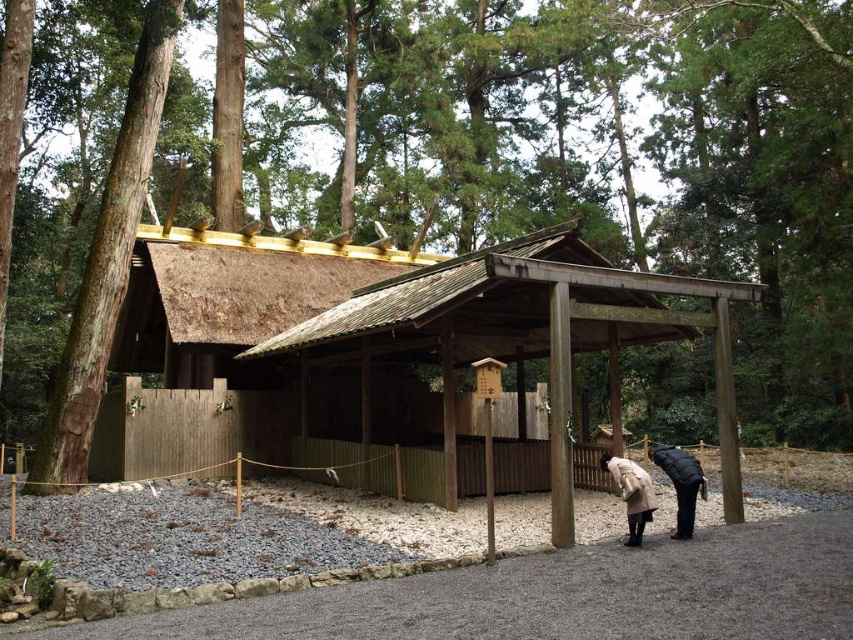
Which is behind, point (691, 468) or point (651, 484)?

The point (691, 468) is more distant.

Between black matte coat at lower right and beige wool coat at lower center, which one has more height?

With more height is black matte coat at lower right.

Does point (676, 534) come closer to viewer compared to point (630, 460)?

Yes, it is in front of point (630, 460).

The height and width of the screenshot is (640, 853). In order to click on black matte coat at lower right in this screenshot , I will do `click(680, 483)`.